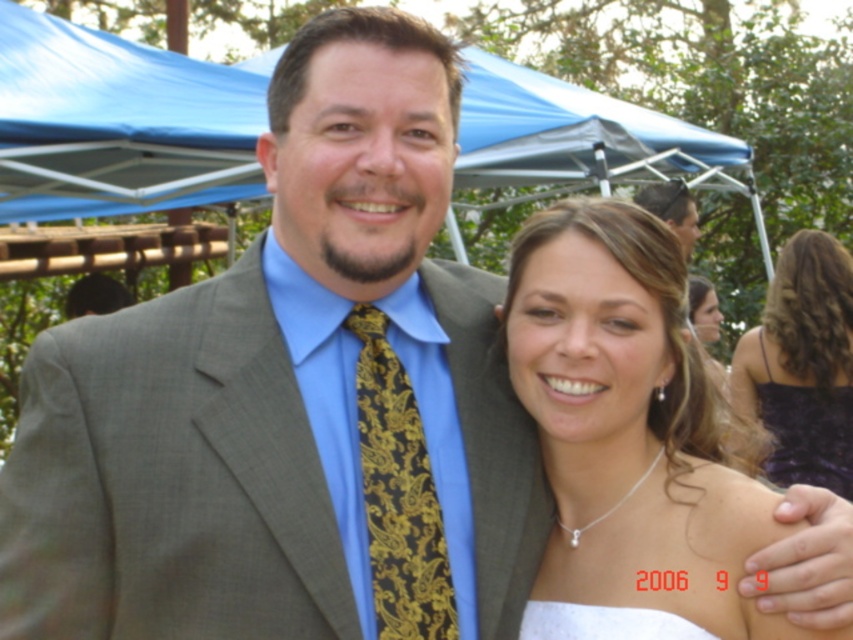
Is white satin dress at center further to the viewer compared to purple satin dress at right?

No, it is not.

Consider the image. Does white satin dress at center have a smaller size compared to purple satin dress at right?

Correct, white satin dress at center occupies less space than purple satin dress at right.

Describe the element at coordinates (630, 428) in the screenshot. Image resolution: width=853 pixels, height=640 pixels. I see `white satin dress at center` at that location.

Image resolution: width=853 pixels, height=640 pixels. What are the coordinates of `white satin dress at center` in the screenshot? It's located at (630, 428).

Who is positioned more to the right, matte gray suit at center or white satin dress at lower right?

From the viewer's perspective, white satin dress at lower right appears more on the right side.

Does point (225, 584) come behind point (695, 632)?

No, it is not.

The width and height of the screenshot is (853, 640). Describe the element at coordinates (192, 525) in the screenshot. I see `matte gray suit at center` at that location.

At what (x,y) coordinates should I click in order to perform the action: click on matte gray suit at center. Please return your answer as a coordinate pair (x, y). The height and width of the screenshot is (640, 853). Looking at the image, I should click on (192, 525).

Who is more distant from viewer, (776,531) or (164,570)?

The point (776,531) is behind.

Between point (628, 460) and point (323, 580), which one is positioned in front?

Point (323, 580) is in front.

Is point (517, 346) positioned before point (144, 440)?

No, it is behind (144, 440).

Locate an element on the screen. This screenshot has height=640, width=853. white satin dress at center is located at coordinates (630, 428).